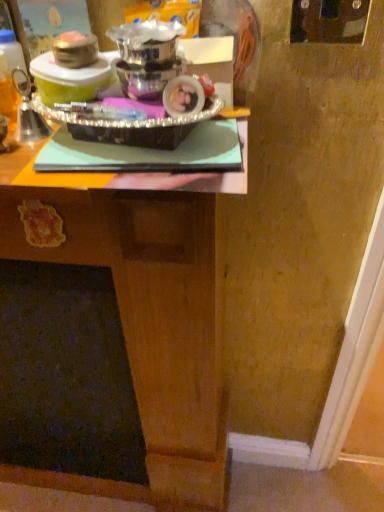
You are a GUI agent. You are given a task and a screenshot of the screen. Output one action in this format:
    pyautogui.click(x=<x>, y=<y>)
    Task: Click on the wooden desk at center
    This screenshot has width=384, height=512.
    Given the screenshot: What is the action you would take?
    pyautogui.click(x=156, y=311)

The height and width of the screenshot is (512, 384). Describe the element at coordinates (156, 311) in the screenshot. I see `wooden desk at center` at that location.

At what (x,y) coordinates should I click in order to perform the action: click on wooden desk at center. Please return your answer as a coordinate pair (x, y). This screenshot has height=512, width=384. Looking at the image, I should click on (156, 311).